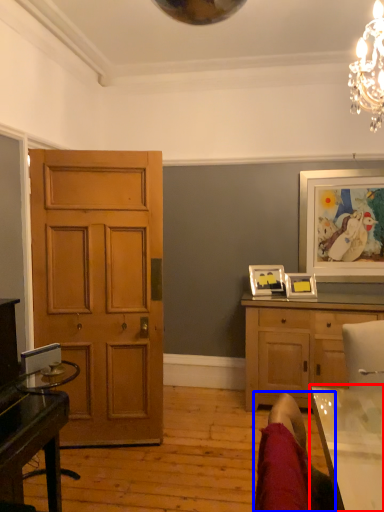
Question: Which object appears farthest to the camera in this image, table (highlighted by a red box) or swivel chair (highlighted by a blue box)?

Choices:
 (A) table
 (B) swivel chair

Answer: (A)